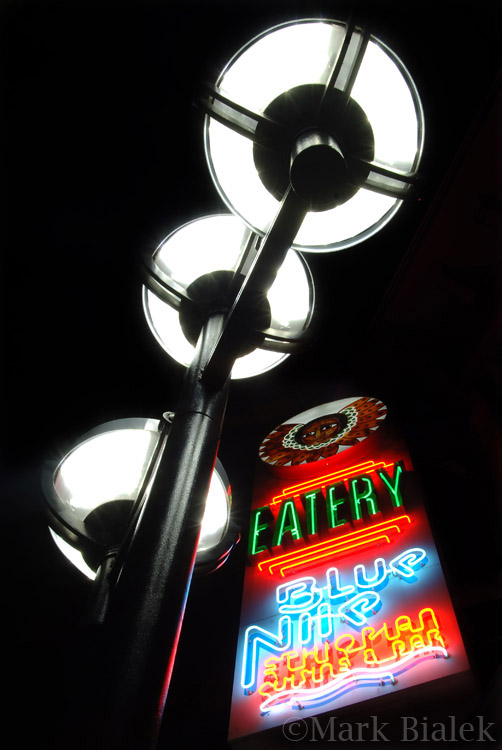
The height and width of the screenshot is (750, 502). In order to click on neon sign in this screenshot , I will do `click(303, 601)`.